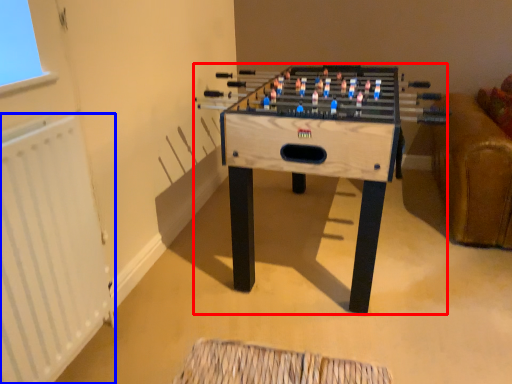
Question: Which object is further to the camera taking this photo, table (highlighted by a red box) or radiator (highlighted by a blue box)?

Choices:
 (A) table
 (B) radiator

Answer: (A)